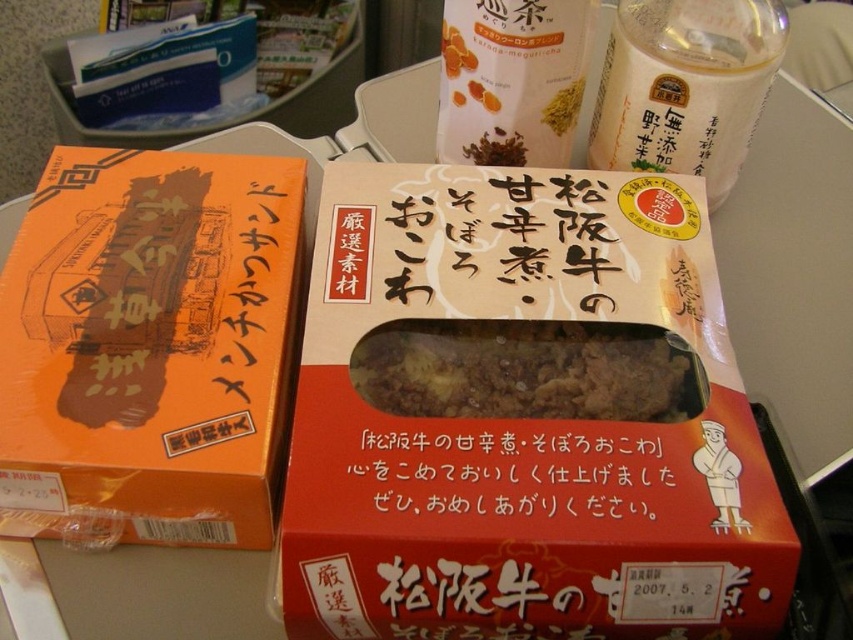
You are organizing items on a shelf and see the white matte bottle at upper right and the white matte bottle at upper center. Which one is positioned more to the right?

The white matte bottle at upper right is positioned more to the right compared to the white matte bottle at upper center.

You are organizing items on a shelf and need to place both the black paper at center and the white matte bottle at upper center. Based on their positions in the image, which item should you place first to maintain the original arrangement?

You should place the white matte bottle at upper center first because the black paper at center is below it in the image, so positioning the bottle first allows the paper to be placed beneath it accordingly.